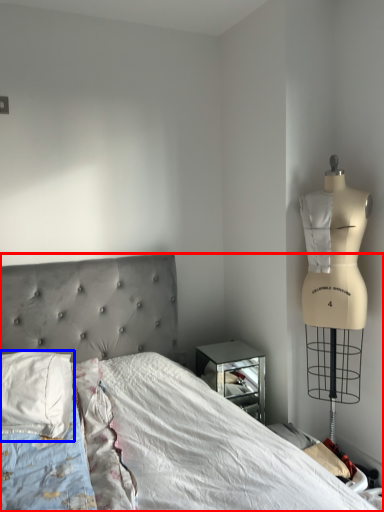
Question: Among these objects, which one is nearest to the camera, bed (highlighted by a red box) or pillow (highlighted by a blue box)?

Choices:
 (A) bed
 (B) pillow

Answer: (A)